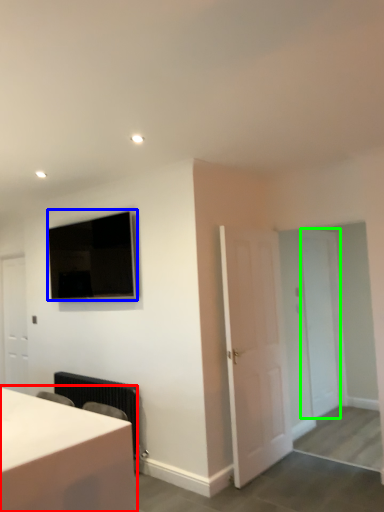
Question: Considering the real-world distances, which object is closest to table (highlighted by a red box)? television (highlighted by a blue box) or door (highlighted by a green box).

Choices:
 (A) television
 (B) door

Answer: (A)